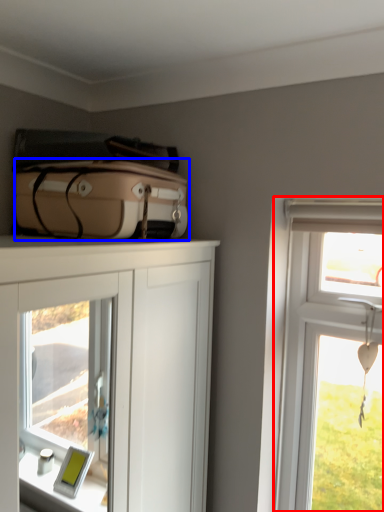
Question: Which object is further to the camera taking this photo, window (highlighted by a red box) or suitcase (highlighted by a blue box)?

Choices:
 (A) window
 (B) suitcase

Answer: (A)